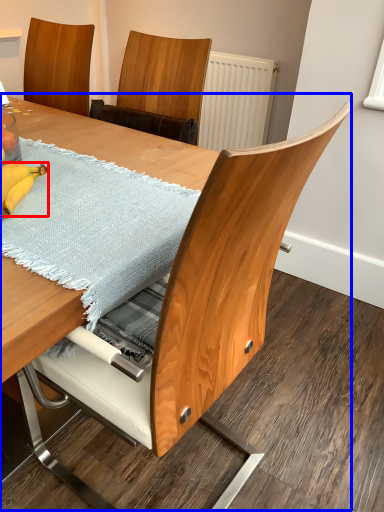
Question: Among these objects, which one is nearest to the camera, banana (highlighted by a red box) or table (highlighted by a blue box)?

Choices:
 (A) banana
 (B) table

Answer: (B)